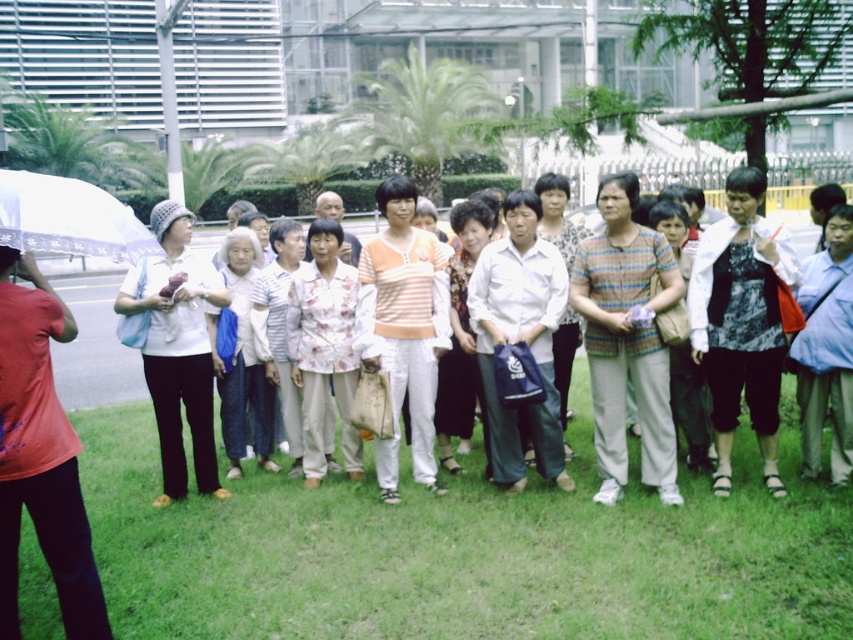
You are standing at the point closest to the camera in the image. There are two points marked in the scene, one at coordinates point (1,252) and another at point (757,396). Which point is closer to your current position?

Point (1,252) is in front of point (757,396), so it is closer to your current position.

You are standing at the edge of the grassy area and want to step onto the green grass at lower center. Based on its position, can you estimate whether it is directly in front of you or to one side?

The green grass at lower center is located at point coordinates that are not provided in the scene description, so I cannot determine its exact position relative to your current location. However, since it is labeled as being at lower center, it is likely positioned in the central lower part of the image, which might correspond to directly in front if you are facing the scene.

You are a photographer trying to capture a photo of the group. You notice the green grass at lower center and the matte white shirt at center. Which object takes up more area in the image?

The matte white shirt at center occupies more space than the green grass at lower center in the image.